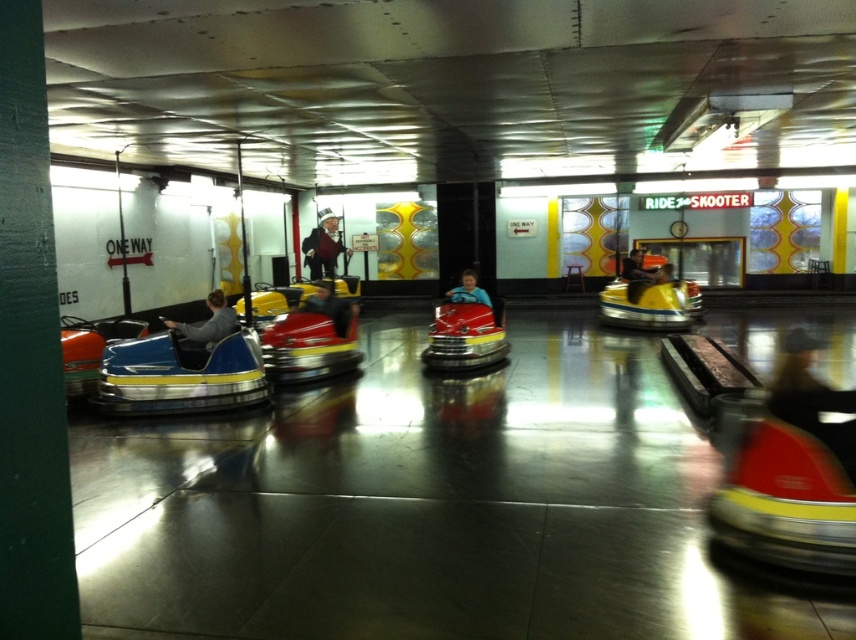
Question: Which object appears farthest from the camera in this image?

Choices:
 (A) smooth black suit at center
 (B) matte black helmet at center
 (C) matte gray jacket at left
 (D) yellow matte bumper car at center

Answer: (A)

Question: Can you confirm if yellow matte bumper car at center is positioned to the left of matte black helmet at center?

Choices:
 (A) no
 (B) yes

Answer: (A)

Question: Which point is closer to the camera?

Choices:
 (A) matte yellow helmet at center
 (B) smooth blue helmet at center
 (C) matte gray jacket at left

Answer: (C)

Question: Is yellow matte bumper car at center to the right of matte yellow helmet at center from the viewer's perspective?

Choices:
 (A) yes
 (B) no

Answer: (A)

Question: Considering the relative positions of smooth black suit at center and matte gray jacket at left in the image provided, where is smooth black suit at center located with respect to matte gray jacket at left?

Choices:
 (A) below
 (B) above

Answer: (B)

Question: Which of the following is the closest to the observer?

Choices:
 (A) (310, 230)
 (B) (635, 307)
 (C) (642, 262)
 (D) (464, 280)

Answer: (D)